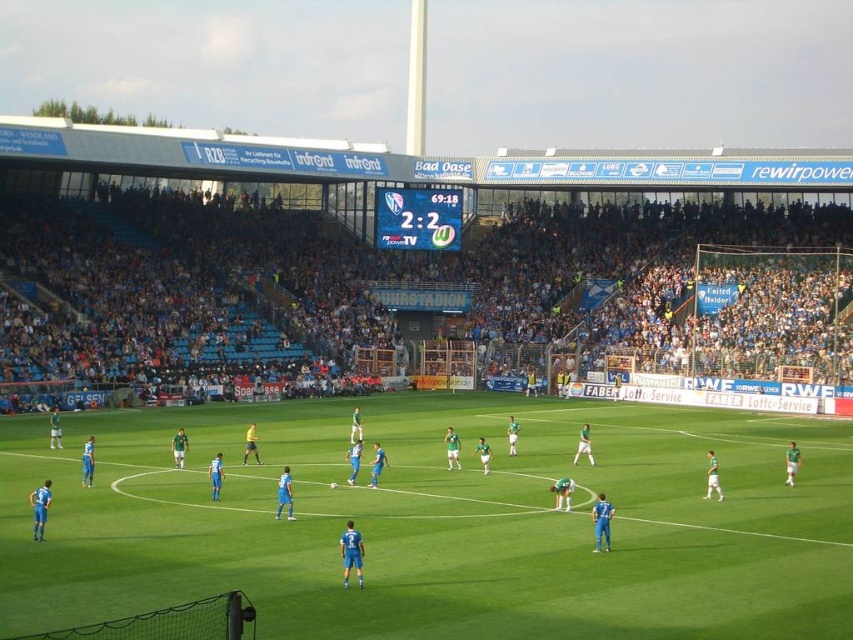
Is point (399, 632) more distant than point (39, 364)?

No.

Can you confirm if green grass field at center is thinner than blue plastic seats at upper center?

Indeed, green grass field at center has a lesser width compared to blue plastic seats at upper center.

Which is behind, point (430, 593) or point (294, 340)?

The point (294, 340) is behind.

Identify the location of green grass field at center. (442, 524).